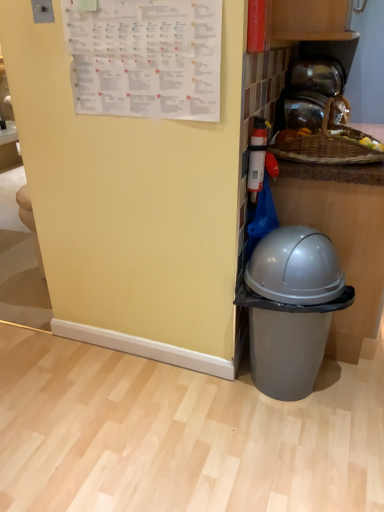
Locate an element on the screen. The image size is (384, 512). woven wood basket at upper right is located at coordinates (329, 160).

Considering the relative positions of gray plastic trash can at lower right and white paper calendar at upper left in the image provided, is gray plastic trash can at lower right to the left or to the right of white paper calendar at upper left?

Clearly, gray plastic trash can at lower right is on the right of white paper calendar at upper left in the image.

Could you tell me if gray plastic trash can at lower right is facing white paper calendar at upper left?

No, gray plastic trash can at lower right is not aimed at white paper calendar at upper left.

Which is nearer, (248, 265) or (102, 40)?

The point (102, 40) is in front.

From the image's perspective, is gray plastic trash can at lower right located above or below white paper calendar at upper left?

From the image's perspective, gray plastic trash can at lower right appears below white paper calendar at upper left.

Would you say white paper calendar at upper left is part of transparent glass jar at upper right's contents?

No, white paper calendar at upper left is located outside of transparent glass jar at upper right.

Is transparent glass jar at upper right smaller than white paper calendar at upper left?

No, transparent glass jar at upper right is not smaller than white paper calendar at upper left.

The height and width of the screenshot is (512, 384). Find the location of `appliance above the white paper calendar at upper left (from the image's perspective)`. appliance above the white paper calendar at upper left (from the image's perspective) is located at coordinates (311, 95).

Is transparent glass jar at upper right facing towards white paper calendar at upper left?

No.

Which object is further away from the camera taking this photo, woven wood basket at upper right or gray plastic trash can at lower right?

woven wood basket at upper right is further from the camera.

Which is more to the left, woven wood basket at upper right or gray plastic trash can at lower right?

From the viewer's perspective, gray plastic trash can at lower right appears more on the left side.

Could you tell me if woven wood basket at upper right is turned towards gray plastic trash can at lower right?

No, woven wood basket at upper right is not oriented towards gray plastic trash can at lower right.

Which of these two, woven wood basket at upper right or gray plastic trash can at lower right, stands taller?

gray plastic trash can at lower right is taller.

Based on the photo, from a real-world perspective, is woven wood basket at upper right on white paper calendar at upper left?

Incorrect, from a real-world perspective, woven wood basket at upper right is lower than white paper calendar at upper left.

Considering the relative sizes of woven wood basket at upper right and white paper calendar at upper left in the image provided, is woven wood basket at upper right smaller than white paper calendar at upper left?

Incorrect, woven wood basket at upper right is not smaller in size than white paper calendar at upper left.

The image size is (384, 512). What are the coordinates of `counter top located below the white paper calendar at upper left (from the image's perspective)` in the screenshot? It's located at [329, 160].

Which point is more distant from viewer, (327,175) or (204,68)?

Positioned behind is point (327,175).

Consider the image. Which is correct: transparent glass jar at upper right is inside woven wood basket at upper right, or outside of it?

transparent glass jar at upper right exists outside the volume of woven wood basket at upper right.

Which of these two, transparent glass jar at upper right or woven wood basket at upper right, stands shorter?

With less height is transparent glass jar at upper right.

Is transparent glass jar at upper right at the left side of woven wood basket at upper right?

Incorrect, transparent glass jar at upper right is not on the left side of woven wood basket at upper right.

Where is `appliance on the right of the woven wood basket at upper right`? Image resolution: width=384 pixels, height=512 pixels. appliance on the right of the woven wood basket at upper right is located at coordinates (311, 95).

Does point (72, 36) come closer to viewer compared to point (282, 113)?

Yes, point (72, 36) is in front of point (282, 113).

In the scene shown: Can you confirm if white paper calendar at upper left is bigger than transparent glass jar at upper right?

Incorrect, white paper calendar at upper left is not larger than transparent glass jar at upper right.

Considering the sizes of white paper calendar at upper left and transparent glass jar at upper right in the image, is white paper calendar at upper left wider or thinner than transparent glass jar at upper right?

Considering their sizes, white paper calendar at upper left looks slimmer than transparent glass jar at upper right.

Is white paper calendar at upper left oriented away from transparent glass jar at upper right?

Absolutely, white paper calendar at upper left is directed away from transparent glass jar at upper right.

What's the angular difference between woven wood basket at upper right and transparent glass jar at upper right's facing directions?

The angle between the facing direction of woven wood basket at upper right and the facing direction of transparent glass jar at upper right is 2.61 degrees.

From a real-world perspective, which object rests below the other?

woven wood basket at upper right.

Is woven wood basket at upper right smaller than transparent glass jar at upper right?

No, woven wood basket at upper right is not smaller than transparent glass jar at upper right.

Is the surface of woven wood basket at upper right in direct contact with transparent glass jar at upper right?

No.

Where is `writing in front of the gray plastic trash can at lower right`? writing in front of the gray plastic trash can at lower right is located at coordinates (146, 58).

At what (x,y) coordinates should I click in order to perform the action: click on writing above the transparent glass jar at upper right (from a real-world perspective). Please return your answer as a coordinate pair (x, y). Looking at the image, I should click on (146, 58).

Looking at the image, which one is located closer to transparent glass jar at upper right, woven wood basket at upper right or white paper calendar at upper left?

woven wood basket at upper right.

Consider the image. Which object lies nearer to the anchor point transparent glass jar at upper right, gray plastic trash can at lower right or woven wood basket at upper right?

woven wood basket at upper right lies closer to transparent glass jar at upper right than the other object.

When comparing their distances from transparent glass jar at upper right, does white paper calendar at upper left or gray plastic trash can at lower right seem further?

The object further to transparent glass jar at upper right is gray plastic trash can at lower right.

Looking at the image, which one is located closer to transparent glass jar at upper right, white paper calendar at upper left or woven wood basket at upper right?

woven wood basket at upper right is closer to transparent glass jar at upper right.

Estimate the real-world distances between objects in this image. Which object is further from woven wood basket at upper right, transparent glass jar at upper right or gray plastic trash can at lower right?

gray plastic trash can at lower right.

Looking at the image, which one is located further to white paper calendar at upper left, woven wood basket at upper right or gray plastic trash can at lower right?

gray plastic trash can at lower right is further to white paper calendar at upper left.

Considering their positions, is transparent glass jar at upper right positioned closer to white paper calendar at upper left than woven wood basket at upper right?

The object closer to white paper calendar at upper left is woven wood basket at upper right.

Estimate the real-world distances between objects in this image. Which object is closer to gray plastic trash can at lower right, woven wood basket at upper right or transparent glass jar at upper right?

woven wood basket at upper right.

At what (x,y) coordinates should I click in order to perform the action: click on counter top between white paper calendar at upper left and transparent glass jar at upper right from left to right. Please return your answer as a coordinate pair (x, y). The width and height of the screenshot is (384, 512). Looking at the image, I should click on (329, 160).

Locate an element on the screen. The height and width of the screenshot is (512, 384). counter top between transparent glass jar at upper right and gray plastic trash can at lower right from top to bottom is located at coordinates (329, 160).

Identify the location of writing between transparent glass jar at upper right and gray plastic trash can at lower right vertically. (146, 58).

Locate an element on the screen. This screenshot has width=384, height=512. counter top that lies between white paper calendar at upper left and gray plastic trash can at lower right from top to bottom is located at coordinates (329, 160).